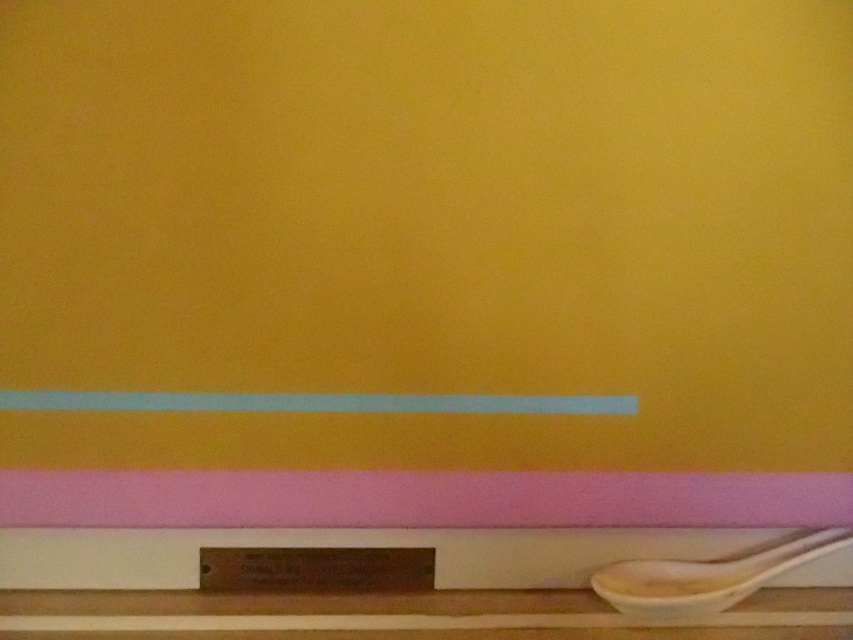
Question: Which object appears closest to the camera in this image?

Choices:
 (A) white ceramic spoon at lower right
 (B) white glossy strip at lower center

Answer: (A)

Question: Among these objects, which one is nearest to the camera?

Choices:
 (A) white glossy strip at lower center
 (B) white ceramic spoon at lower right

Answer: (B)

Question: Can you confirm if white glossy strip at lower center is positioned below white ceramic spoon at lower right?

Choices:
 (A) yes
 (B) no

Answer: (B)

Question: From the image, what is the correct spatial relationship of white glossy strip at lower center in relation to white ceramic spoon at lower right?

Choices:
 (A) below
 (B) above

Answer: (B)

Question: Which of the following is the closest to the observer?

Choices:
 (A) white ceramic spoon at lower right
 (B) white glossy strip at lower center

Answer: (A)

Question: Can you confirm if white glossy strip at lower center is wider than white ceramic spoon at lower right?

Choices:
 (A) no
 (B) yes

Answer: (B)